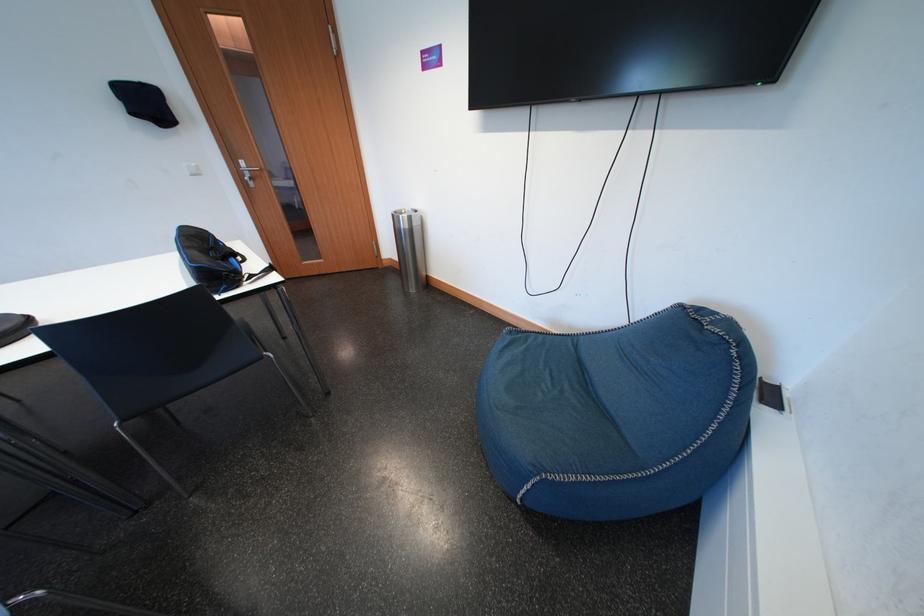
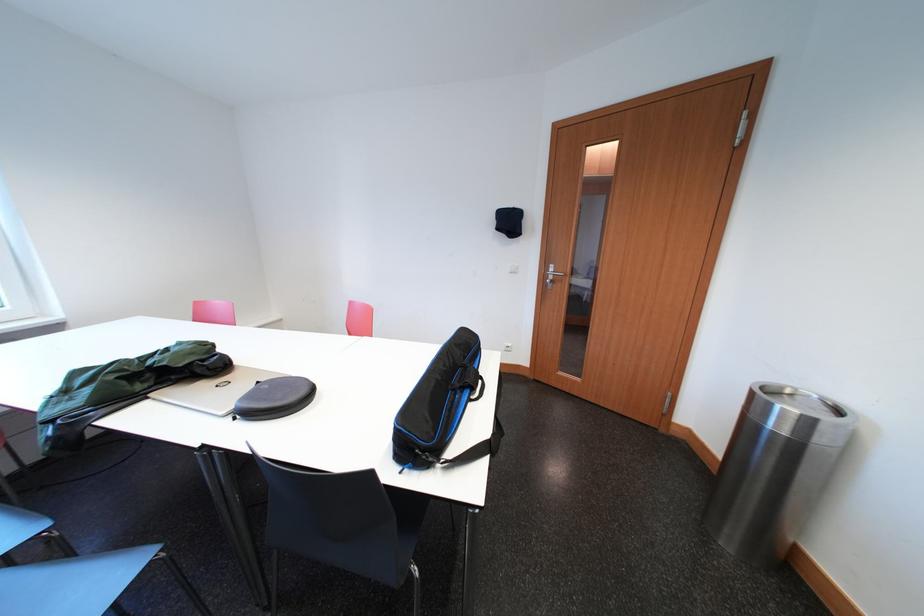
Find the pixel in the second image that matches point 141,118 in the first image.

(506, 233)